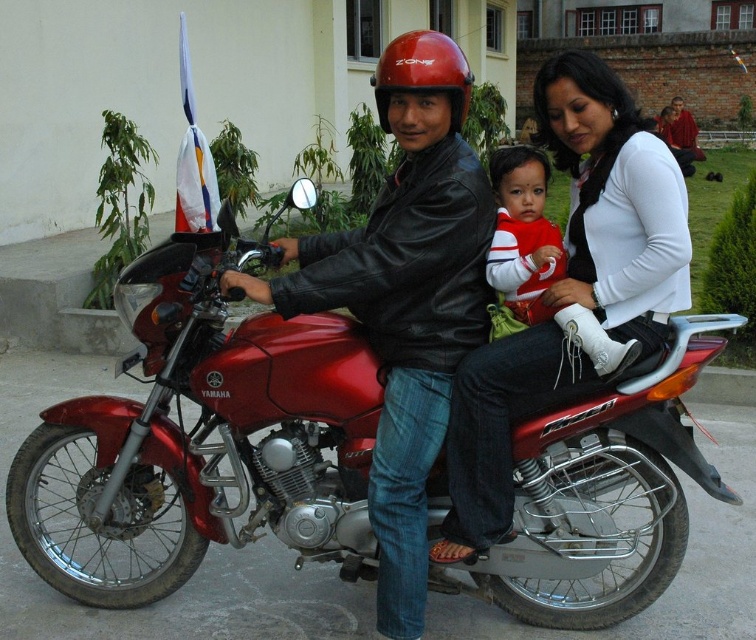
You are a photographer standing at the point with coordinates [206,433]. You want to capture the metallic red motorcycle at center in your photo. Is the motorcycle at the exact center of your current position?

The point at [206,433] is where the metallic red motorcycle at center is located, so yes, the motorcycle is exactly at the center of your current position.

You are a photographer standing in front of the metallic red motorcycle at center and the red and white striped shirt at center. You want to take a photo that captures both objects clearly. Which object should you focus on first to ensure proper depth of field?

The metallic red motorcycle at center is taller than the red and white striped shirt at center, so you should focus on the metallic red motorcycle at center first to ensure proper depth of field.

You are a photographer trying to capture a closeup of the white leather boot at center and the red matte helmet at center. Which object should you zoom in on more to ensure both are in focus, considering their sizes?

The white leather boot at center has a larger width than the red matte helmet at center, so you should zoom in more on the white leather boot at center to ensure both are in focus.